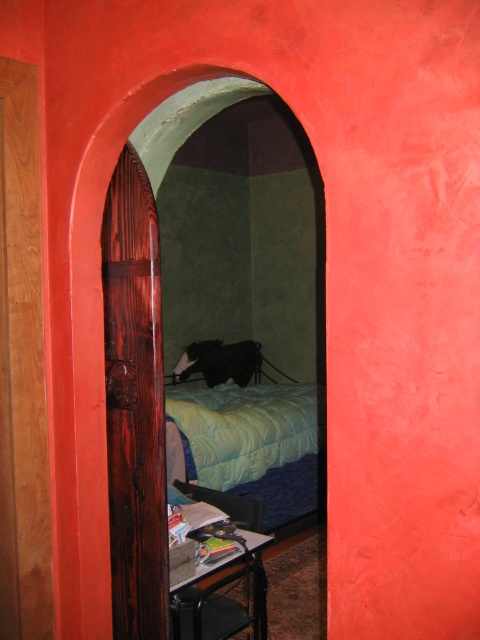
Question: Does wooden door at center have a greater width compared to blue quilted bed at center?

Choices:
 (A) no
 (B) yes

Answer: (A)

Question: Does wooden door at center have a lesser width compared to blue quilted bed at center?

Choices:
 (A) yes
 (B) no

Answer: (A)

Question: Among these objects, which one is farthest from the camera?

Choices:
 (A) blue quilted bed at center
 (B) wooden door at center

Answer: (A)

Question: Is wooden door at center positioned at the back of blue quilted bed at center?

Choices:
 (A) no
 (B) yes

Answer: (A)